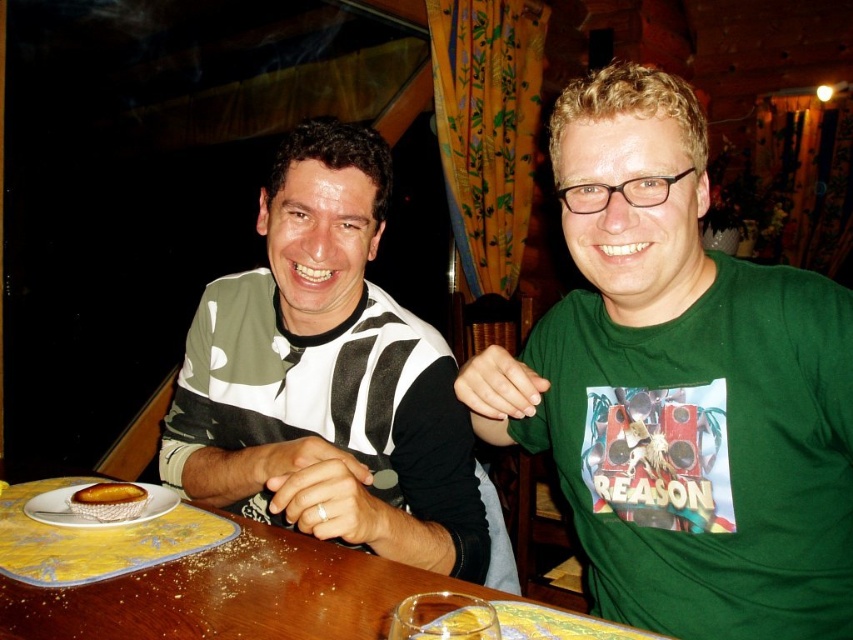
Question: Based on their relative distances, which object is nearer to the golden crispy pastry at lower left?

Choices:
 (A) white ceramic plate at lower left
 (B) striped jersey at center

Answer: (A)

Question: Is green cotton t-shirt at center wider than wooden table at center?

Choices:
 (A) no
 (B) yes

Answer: (A)

Question: Is green cotton t-shirt at center wider than golden crispy pastry at lower left?

Choices:
 (A) yes
 (B) no

Answer: (A)

Question: Does green cotton t-shirt at center appear on the left side of white ceramic plate at lower left?

Choices:
 (A) yes
 (B) no

Answer: (B)

Question: Which object appears closest to the camera in this image?

Choices:
 (A) striped jersey at center
 (B) golden crispy pastry at lower left
 (C) wooden table at center
 (D) green cotton t-shirt at center

Answer: (C)

Question: Among these points, which one is farthest from the camera?

Choices:
 (A) (254, 538)
 (B) (143, 484)
 (C) (128, 518)

Answer: (B)